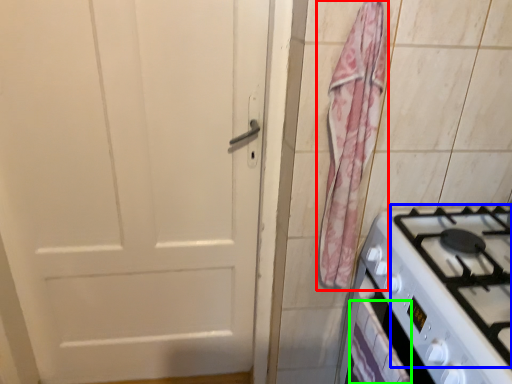
Question: Based on their relative distances, which object is nearer to curtain (highlighted by a red box)? Choose from gas stove (highlighted by a blue box) and drawer (highlighted by a green box).

Choices:
 (A) gas stove
 (B) drawer

Answer: (A)